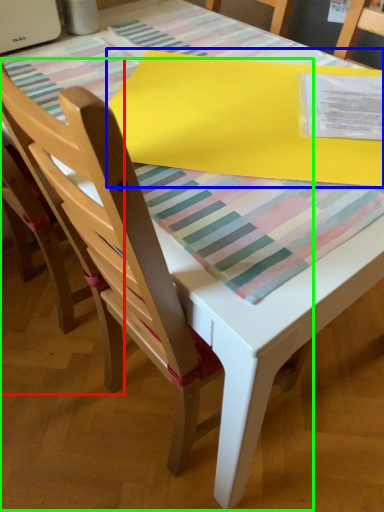
Question: Estimate the real-world distances between objects in this image. Which object is farther from chair (highlighted by a red box), blanket (highlighted by a blue box) or chair (highlighted by a green box)?

Choices:
 (A) blanket
 (B) chair

Answer: (A)